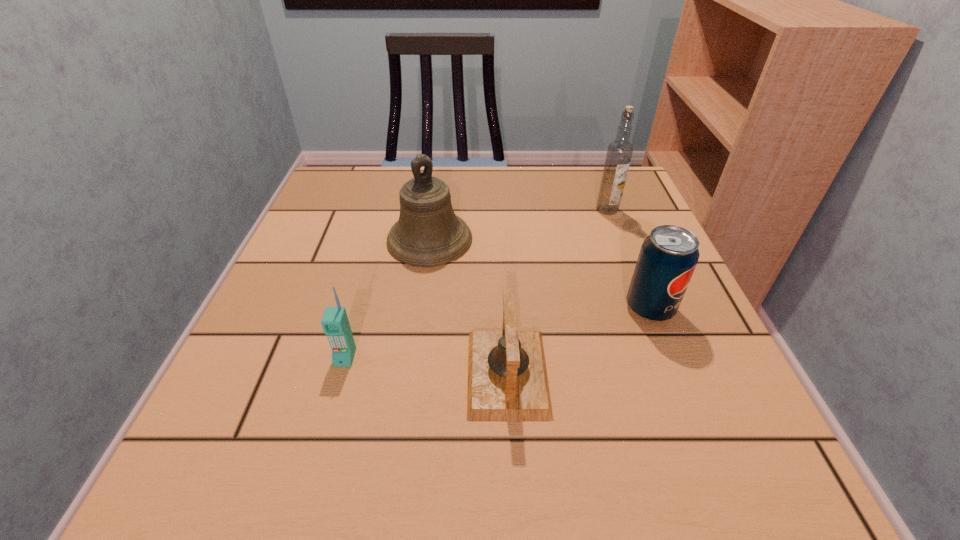
Where is `vacant area at the left edge`? vacant area at the left edge is located at coordinates (311, 419).

In the image, there is a desktop. At what (x,y) coordinates should I click in order to perform the action: click on vacant space at the right edge. Please return your answer as a coordinate pair (x, y). The height and width of the screenshot is (540, 960). Looking at the image, I should click on (700, 348).

The width and height of the screenshot is (960, 540). Identify the location of free space at the far left corner of the desktop. (334, 208).

In the image, there is a desktop. At what (x,y) coordinates should I click in order to perform the action: click on free space at the far right corner. Please return your answer as a coordinate pair (x, y). Image resolution: width=960 pixels, height=540 pixels. Looking at the image, I should click on (599, 180).

This screenshot has height=540, width=960. In the image, there is a desktop. What are the coordinates of `free space at the near right corner` in the screenshot? It's located at (696, 471).

What are the coordinates of `free space between the soda can and the second tallest object` in the screenshot? It's located at (540, 274).

Where is `free space between the leftmost object and the tallest object`? This screenshot has width=960, height=540. free space between the leftmost object and the tallest object is located at coordinates tap(476, 284).

Image resolution: width=960 pixels, height=540 pixels. What are the coordinates of `empty location between the shorter bell and the tallest object` in the screenshot? It's located at (557, 292).

The width and height of the screenshot is (960, 540). I want to click on vacant area that lies between the leftmost object and the vodka, so click(x=476, y=284).

The image size is (960, 540). I want to click on vacant space that's between the cellular telephone and the nearer bell, so (426, 365).